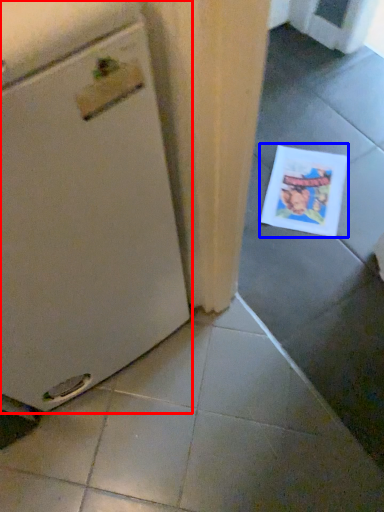
Question: Which point is closer to the camera, home appliance (highlighted by a red box) or comic book (highlighted by a blue box)?

Choices:
 (A) home appliance
 (B) comic book

Answer: (A)